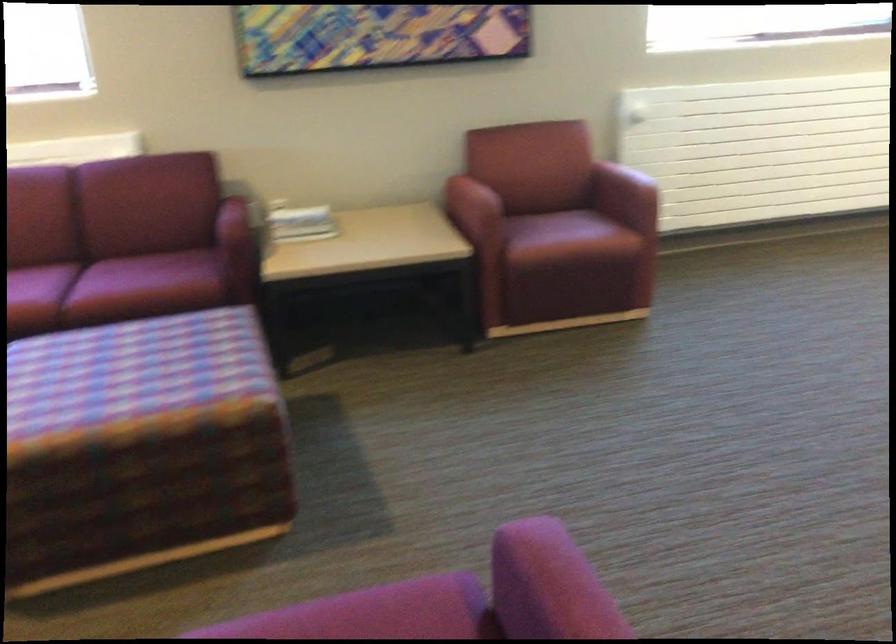
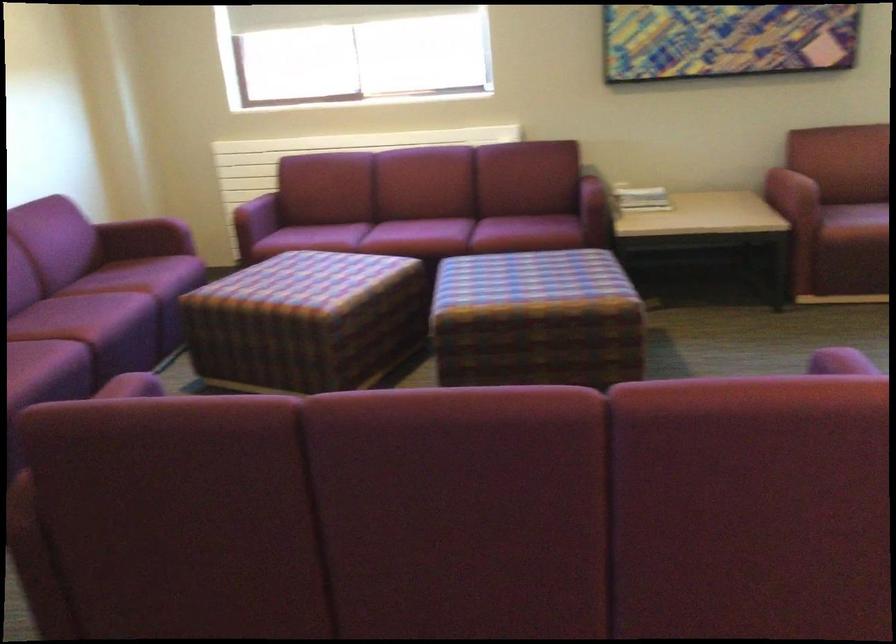
In the second image, find the point that corresponds to pixel 126 459 in the first image.

(536, 319)